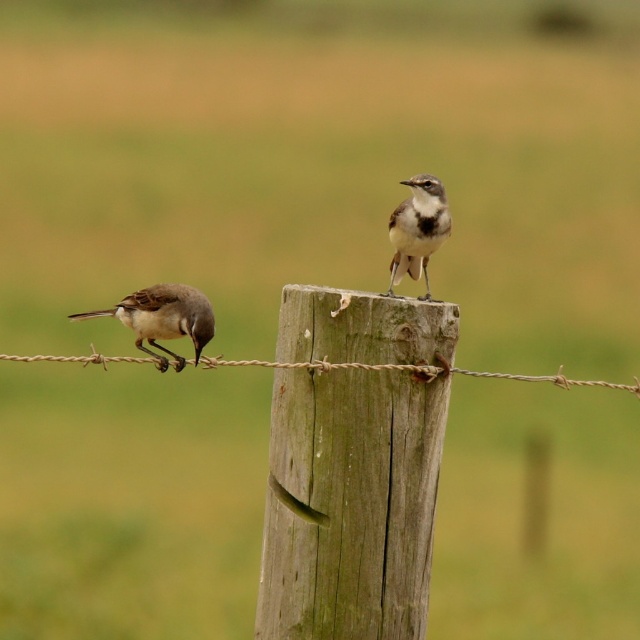
Locate an element on the screen. The height and width of the screenshot is (640, 640). brown speckled feathers at left is located at coordinates (163, 317).

Does brown speckled feathers at left appear on the right side of gray speckled bird at upper center?

No, brown speckled feathers at left is not to the right of gray speckled bird at upper center.

Find the location of a particular element. brown speckled feathers at left is located at coordinates (163, 317).

Does point (637, 385) come farther from viewer compared to point (420, 252)?

No, it is in front of (420, 252).

Does point (472, 371) come in front of point (392, 272)?

No, it is not.

This screenshot has width=640, height=640. In order to click on brown rope at center in this screenshot , I will do `click(419, 371)`.

From the picture: Does weathered wood post at center have a greater width compared to brown speckled feathers at left?

No.

Can you confirm if weathered wood post at center is shorter than brown speckled feathers at left?

No.

Where is `weathered wood post at center`? The image size is (640, 640). weathered wood post at center is located at coordinates (353, 465).

What are the coordinates of `weathered wood post at center` in the screenshot? It's located at (353, 465).